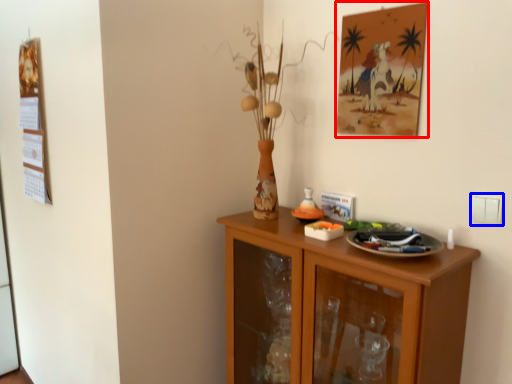
Question: Among these objects, which one is farthest to the camera, picture frame (highlighted by a red box) or electric outlet (highlighted by a blue box)?

Choices:
 (A) picture frame
 (B) electric outlet

Answer: (A)